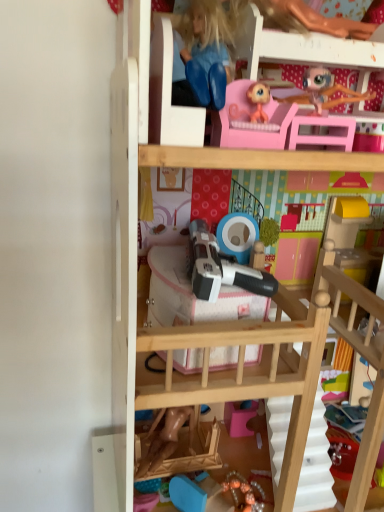
You are a GUI agent. You are given a task and a screenshot of the screen. Output one action in this format:
    pyautogui.click(x=<x>, y=<y>)
    Task: Click on the wooden dollhouse at center
    The image size is (384, 512).
    Given the screenshot: What is the action you would take?
    pyautogui.click(x=210, y=324)

In order to face wooden dollhouse at center, should I rotate leftwards or rightwards?

It's best to rotate right around 15.813 degrees.

Consider the image. What is the approximate width of wooden dollhouse at center?

wooden dollhouse at center is 12.30 inches wide.

What do you see at coordinates (210, 324) in the screenshot? I see `wooden dollhouse at center` at bounding box center [210, 324].

I want to click on wooden dollhouse at center, so click(210, 324).